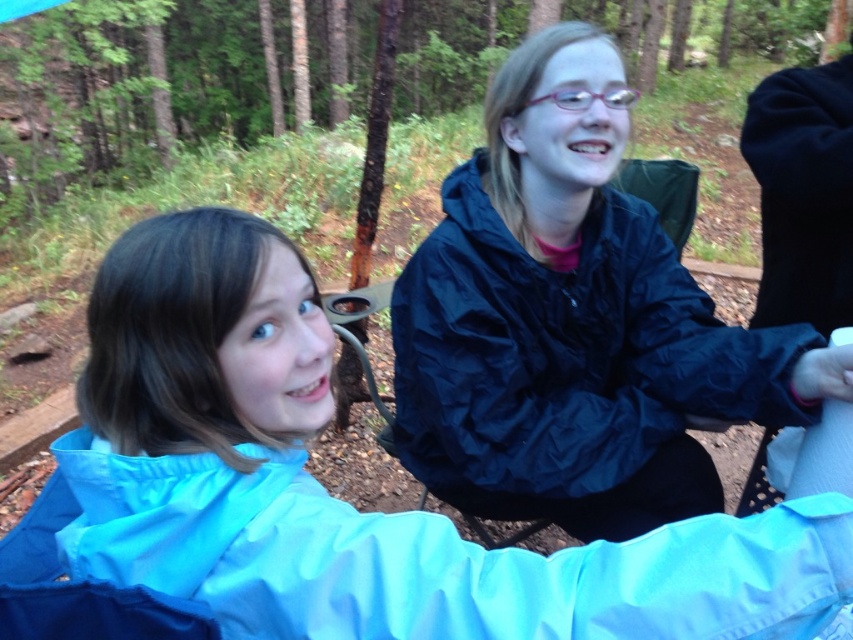
Does blue waterproof jacket at upper left have a greater width compared to matte black jacket at center?

Yes.

How much distance is there between blue waterproof jacket at upper left and matte black jacket at center?

They are 26.63 inches apart.

Who is more distant from viewer, (132, 362) or (708, 369)?

Point (708, 369)

At what (x,y) coordinates should I click in order to perform the action: click on blue waterproof jacket at upper left. Please return your answer as a coordinate pair (x, y). This screenshot has height=640, width=853. Looking at the image, I should click on (328, 493).